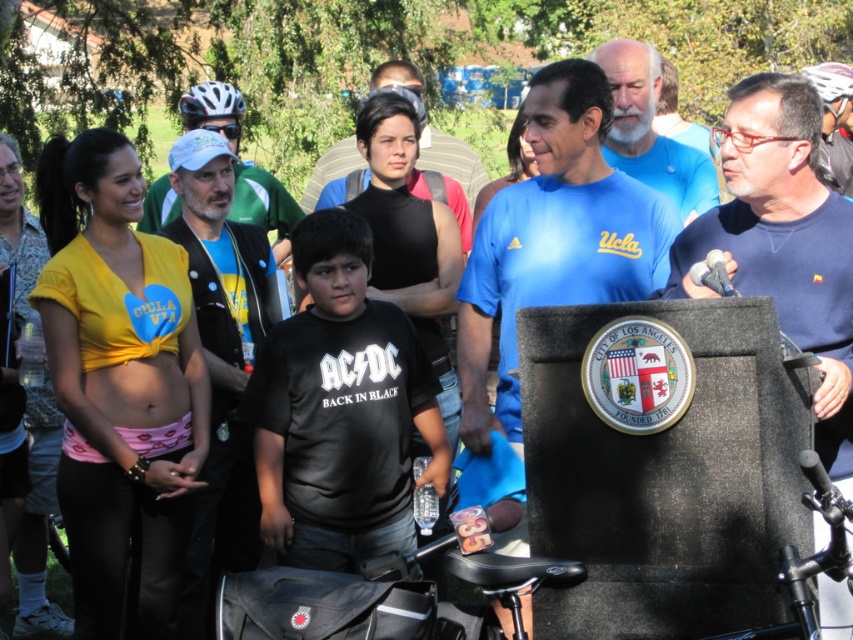
What is located at the coordinates point (138, 392)?

The pink fabric belly is located at point (138, 392).

You are attending a community event and need to identify the largest object between the yellow fabric shirt at left and the shiny silver helmet at upper right. Which one is larger?

The yellow fabric shirt at left is bigger than the shiny silver helmet at upper right.

You are a photographer positioned at the origin point of the image coordinate system. You need to capture a photo of the black matte shirt at center. What are the coordinates where you should aim your camera?

The coordinates to aim your camera are at point [451,161] to capture the black matte shirt at center.